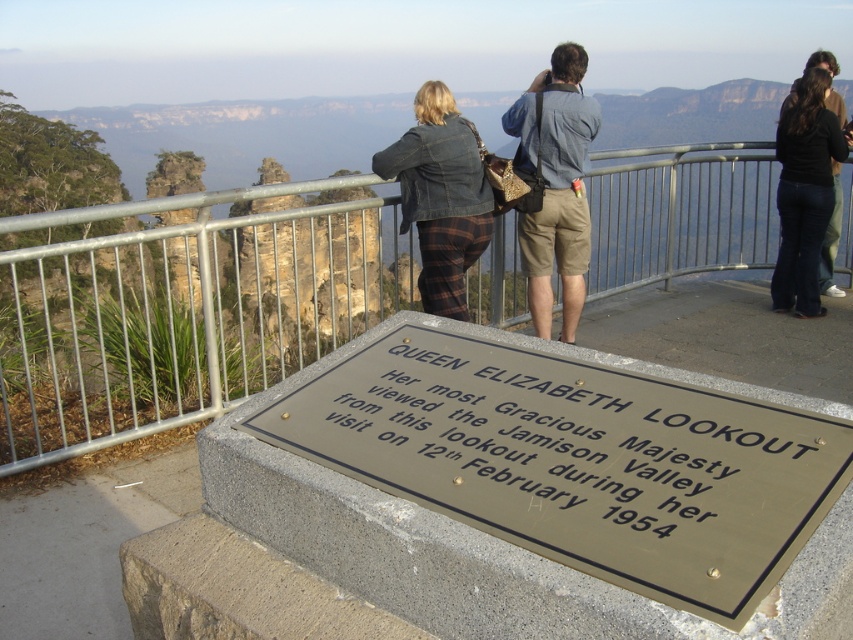
Who is positioned more to the right, denim jacket at center or black denim jeans at right?

Positioned to the right is black denim jeans at right.

Which is behind, point (442, 196) or point (817, 140)?

The point (817, 140) is behind.

This screenshot has width=853, height=640. Identify the location of denim jacket at center. (440, 196).

Is gold/grey stone plaque at center taller than matte blue shirt at center?

No.

Which is more to the right, gold/grey stone plaque at center or matte blue shirt at center?

matte blue shirt at center

Between point (577, 516) and point (550, 56), which one is positioned in front?

Point (577, 516)

Find the location of a particular element. The image size is (853, 640). gold/grey stone plaque at center is located at coordinates (564, 486).

Who is positioned more to the right, matte blue shirt at center or denim jacket at center?

matte blue shirt at center is more to the right.

Does matte blue shirt at center appear on the left side of denim jacket at center?

Incorrect, matte blue shirt at center is not on the left side of denim jacket at center.

Which is behind, point (547, 282) or point (463, 268)?

The point (547, 282) is behind.

This screenshot has height=640, width=853. Identify the location of matte blue shirt at center. (555, 186).